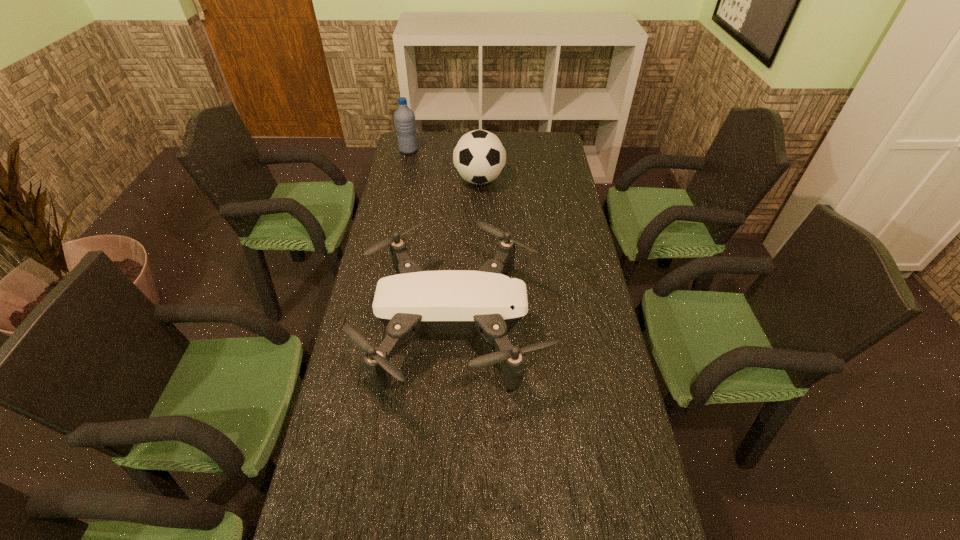
Where is `free space that is in between the nearest object and the second farthest object`? The height and width of the screenshot is (540, 960). free space that is in between the nearest object and the second farthest object is located at coordinates [x=468, y=253].

Find the location of a particular element. The height and width of the screenshot is (540, 960). vacant area that lies between the water bottle and the nearest object is located at coordinates (432, 238).

Select which object appears as the second closest to the shortest object. Please provide its 2D coordinates. Your answer should be formatted as a tuple, i.e. [(x, y)], where the tuple contains the x and y coordinates of a point satisfying the conditions above.

[(404, 117)]

Locate an element on the screen. The image size is (960, 540). the closest object relative to the nearest object is located at coordinates (479, 156).